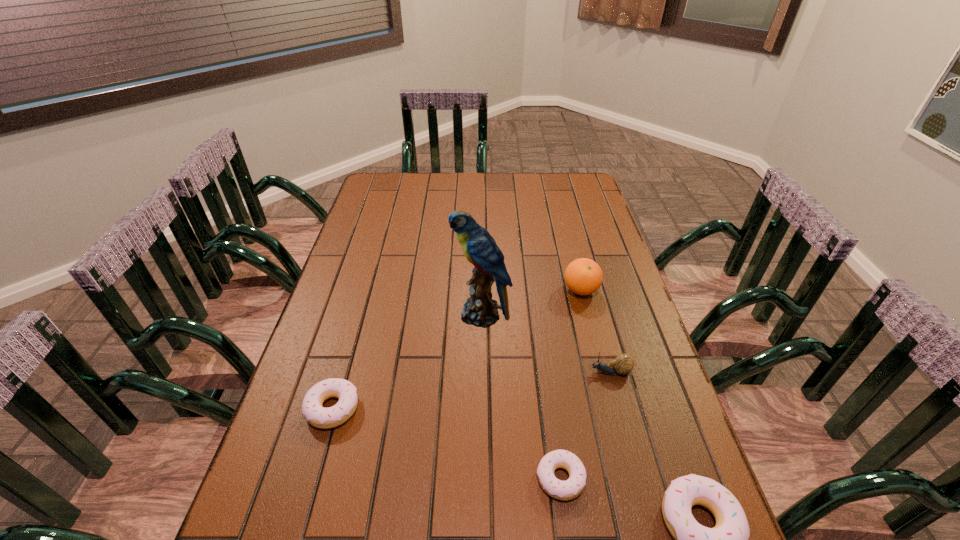
Identify the location of free space for an extra doughnut to achieve even spacing. (439, 441).